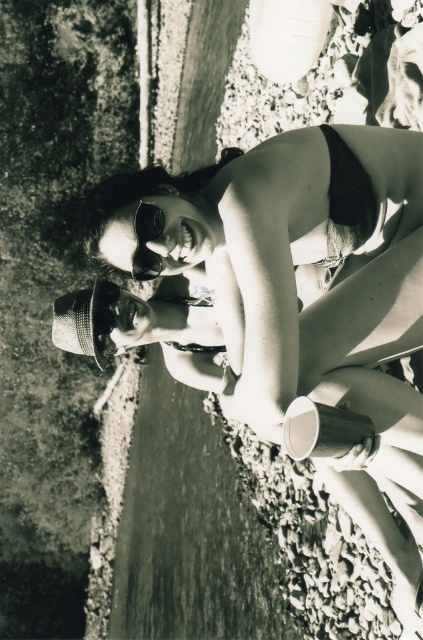
You are a photographer trying to capture the matte black bikini at center in a black and white photo. The coordinates given are point (290, 266). Can you confirm if this point accurately represents the location of the matte black bikini at center?

Yes, the point (290, 266) corresponds to the matte black bikini at center as described in the Objects Description.

You are a photographer standing 5 meters away from the matte black bikini at center. You want to take a closeup shot without moving. Can you do it with a standard zoom lens that has a maximum zoom of 200mm?

The matte black bikini at center and viewer are 3.13 meters apart. Since you are 5 meters away, you are further than the required distance. A standard zoom lens with 200mm can capture subjects at around 5 meters effectively, so yes, you can take a closeup shot without moving.